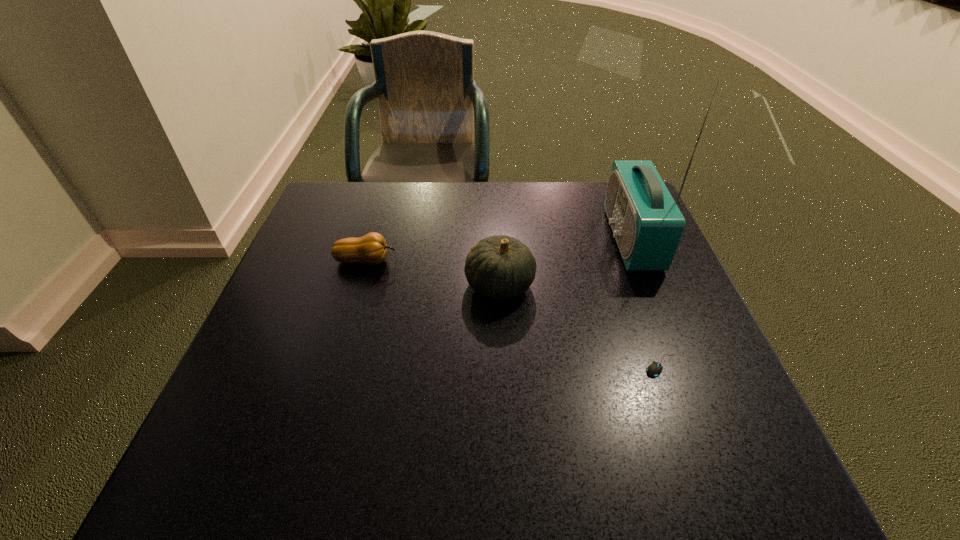
I want to click on object identified as the closest to the radio receiver, so click(x=500, y=267).

Locate an element on the screen. Image resolution: width=960 pixels, height=540 pixels. object that is the second closest to the second shortest object is located at coordinates (647, 224).

The width and height of the screenshot is (960, 540). In order to click on blank space that satisfies the following two spatial constraints: 1. on the back side of the third object from right to left; 2. on the stem side of the shorter gourd in this screenshot , I will do `click(498, 261)`.

Identify the location of free space in the image that satisfies the following two spatial constraints: 1. on the stem side of the shorter gourd; 2. on the right side of the right gourd. The height and width of the screenshot is (540, 960). (359, 285).

You are a GUI agent. You are given a task and a screenshot of the screen. Output one action in this format:
    pyautogui.click(x=<x>, y=<y>)
    Task: Click on the vacant space that satisfies the following two spatial constraints: 1. on the stem side of the second shortest object; 2. on the left side of the shortest object
    
    Given the screenshot: What is the action you would take?
    tap(336, 364)

Image resolution: width=960 pixels, height=540 pixels. What are the coordinates of `free space that satisfies the following two spatial constraints: 1. on the stem side of the shorter gourd; 2. on the left side of the second tallest object` in the screenshot? It's located at (359, 285).

At what (x,y) coordinates should I click in order to perform the action: click on vacant space that satisfies the following two spatial constraints: 1. on the front panel of the tallest object; 2. on the front side of the nearest object. Please return your answer as a coordinate pair (x, y). Looking at the image, I should click on 683,364.